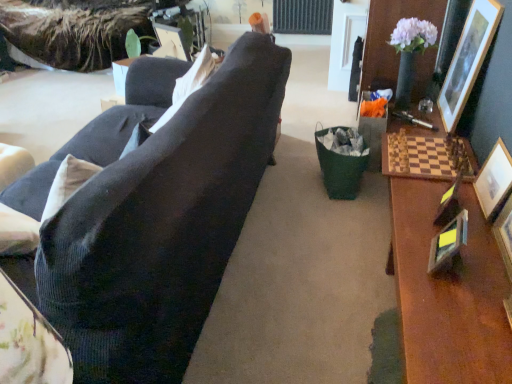
Question: From their relative heights in the image, would you say wooden picture frame at right, acting as the 3th picture frame starting from the right, is taller or shorter than wooden picture frame at upper right, which is the first picture frame in right-to-left order?

Choices:
 (A) tall
 (B) short

Answer: (B)

Question: From the image's perspective, is wooden picture frame at right, the 4th picture frame when ordered from left to right, positioned above or below wooden picture frame at upper right, which is the first picture frame in right-to-left order?

Choices:
 (A) below
 (B) above

Answer: (A)

Question: Which is nearer to the matte plastic picture frame at upper center, acting as the sixth picture frame starting from the right?

Choices:
 (A) wooden picture frame at right, the 4th picture frame when ordered from left to right
 (B) metallic silver picture frame at right, positioned as the fifth picture frame in right-to-left order
 (C) metallic gold picture frame at right, the 4th picture frame from the right
 (D) white fabric pillow at upper center
 (E) wooden picture frame at right, placed as the 5th picture frame when sorted from left to right

Answer: (D)

Question: Estimate the real-world distances between objects in this image. Which object is closer to the wooden picture frame at right, placed as the 5th picture frame when sorted from left to right?

Choices:
 (A) wooden picture frame at upper right, arranged as the 6th picture frame when viewed from the left
 (B) metallic gold picture frame at right, the 4th picture frame from the right
 (C) matte plastic picture frame at upper center, acting as the sixth picture frame starting from the right
 (D) wooden picture frame at right, the 4th picture frame when ordered from left to right
 (E) white fabric pillow at upper center

Answer: (D)